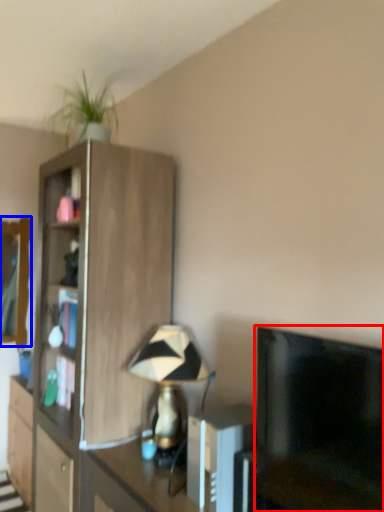
Question: Which of the following is the closest to the observer, television (highlighted by a red box) or mirror (highlighted by a blue box)?

Choices:
 (A) television
 (B) mirror

Answer: (A)